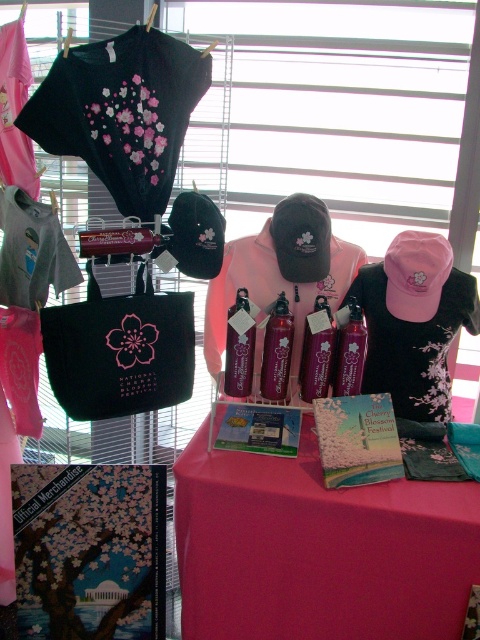
You are standing in front of the display table for the National Cherry Blossom Festival. There are two points marked on the table. The first point is at coordinates point [284,486] and the second is at point [319,365]. Which of these two points appears closer to you?

Point [284,486] is closer to the viewer than point [319,365].

You are organizing the National Cherry Blossom Festival merchandise table and need to place a new item. The pink fabric tablecloth at center is currently covering the table. If you want to place the pink glossy spray bottle at center on the table, will there be enough space to ensure the spray bottle is fully visible without overlapping the tablecloth edges?

The pink fabric tablecloth at center has a larger width than the pink glossy spray bottle at center, so placing the spray bottle in the center will leave enough space around it to remain fully visible without overlapping the tablecloth edges.